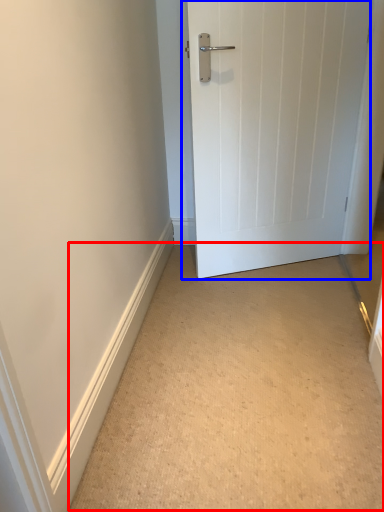
Question: Among these objects, which one is farthest to the camera, corridor (highlighted by a red box) or door (highlighted by a blue box)?

Choices:
 (A) corridor
 (B) door

Answer: (B)